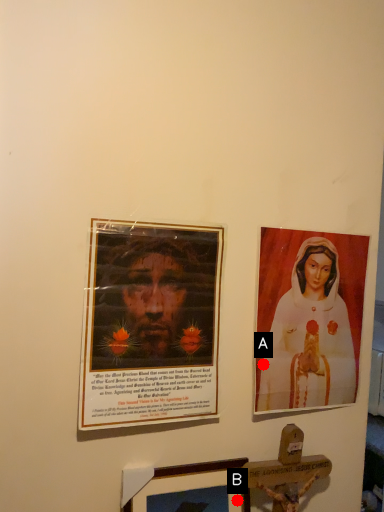
Question: Two points are circled on the image, labeled by A and B beside each circle. Which point is closer to the camera taking this photo?

Choices:
 (A) A is closer
 (B) B is closer

Answer: (A)